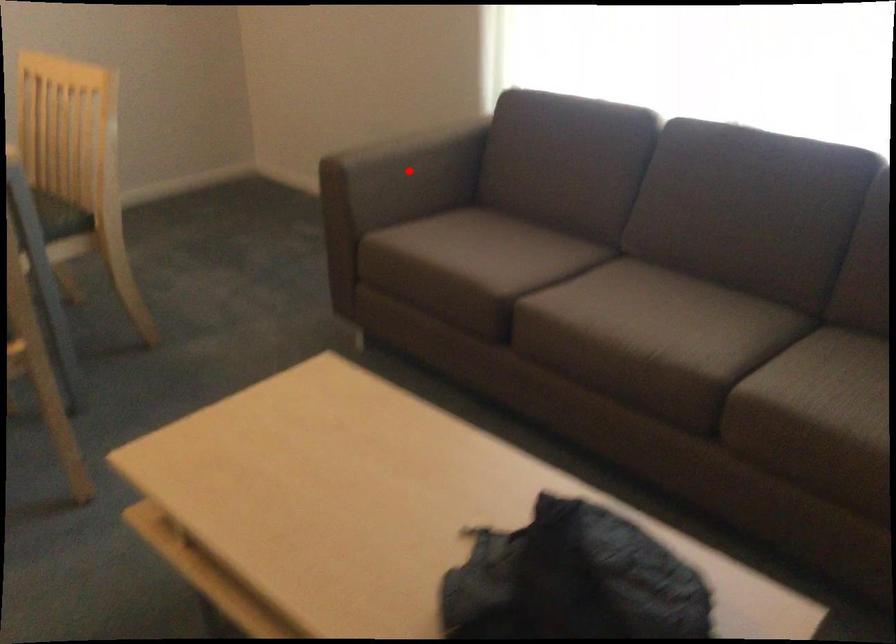
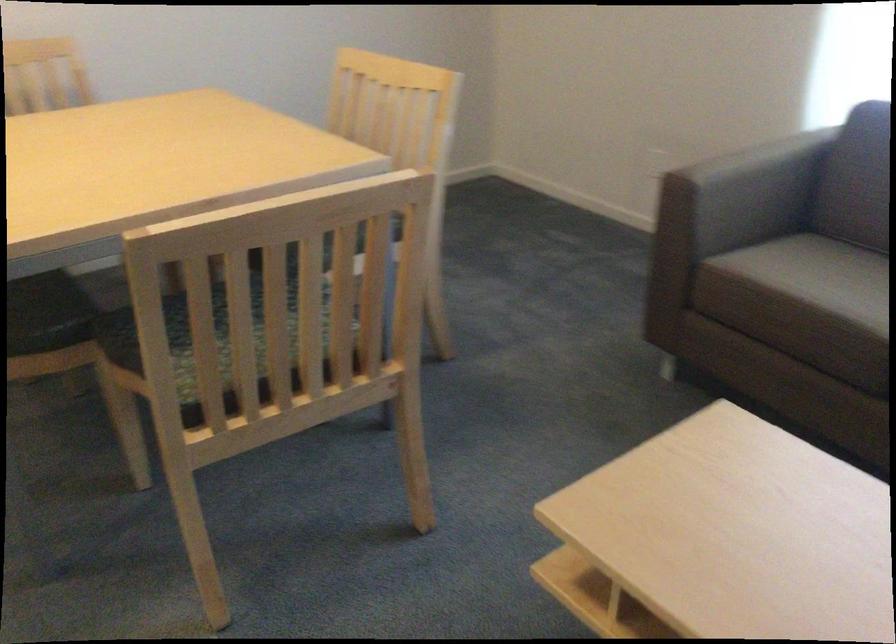
In the second image, find the point that corresponds to the highlighted location in the first image.

(746, 192)